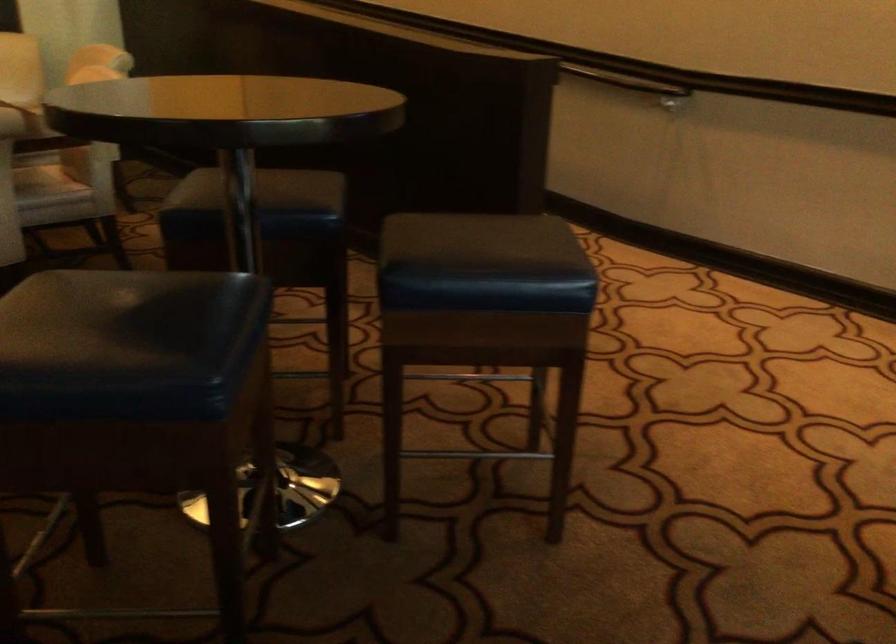
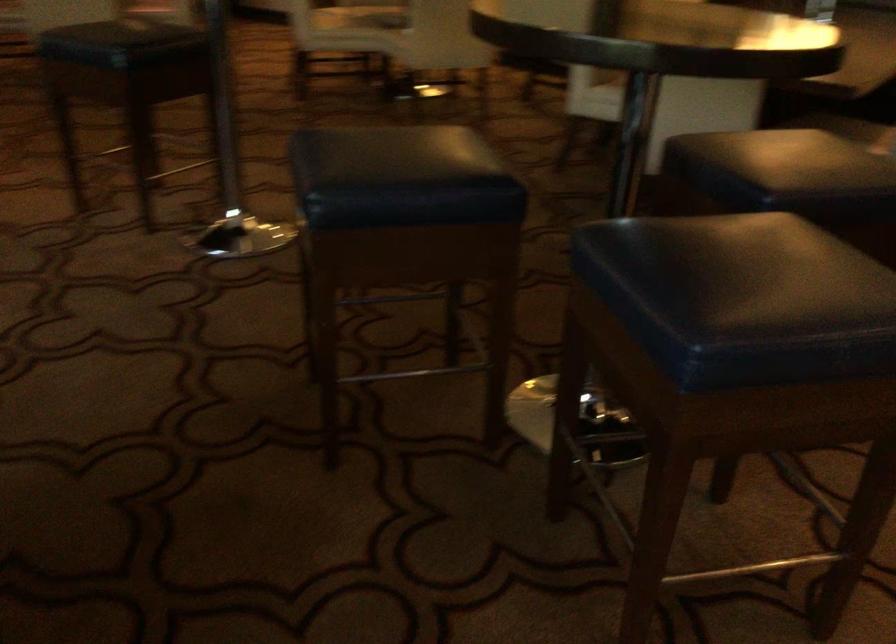
The point at (561, 245) is marked in the first image. Where is the corresponding point in the second image?

(742, 299)